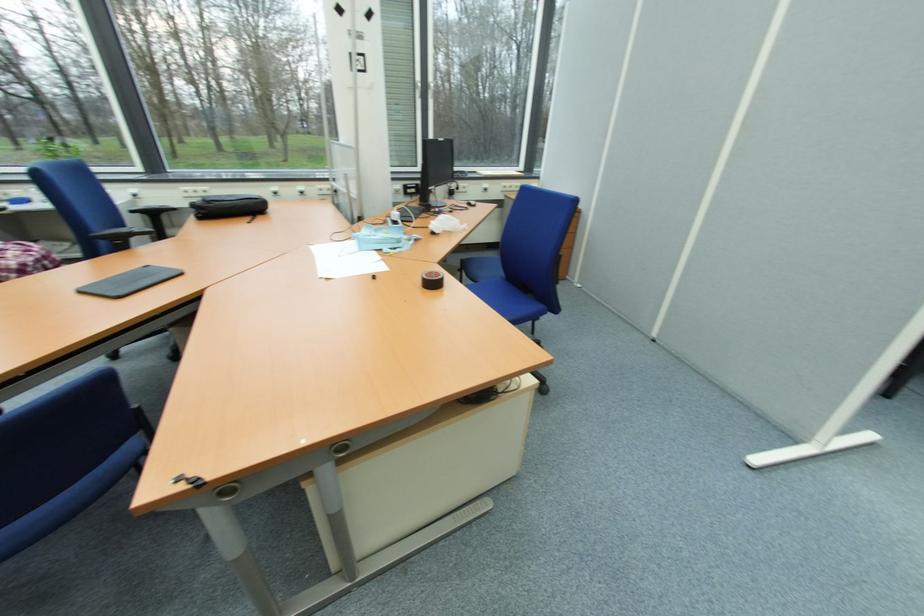
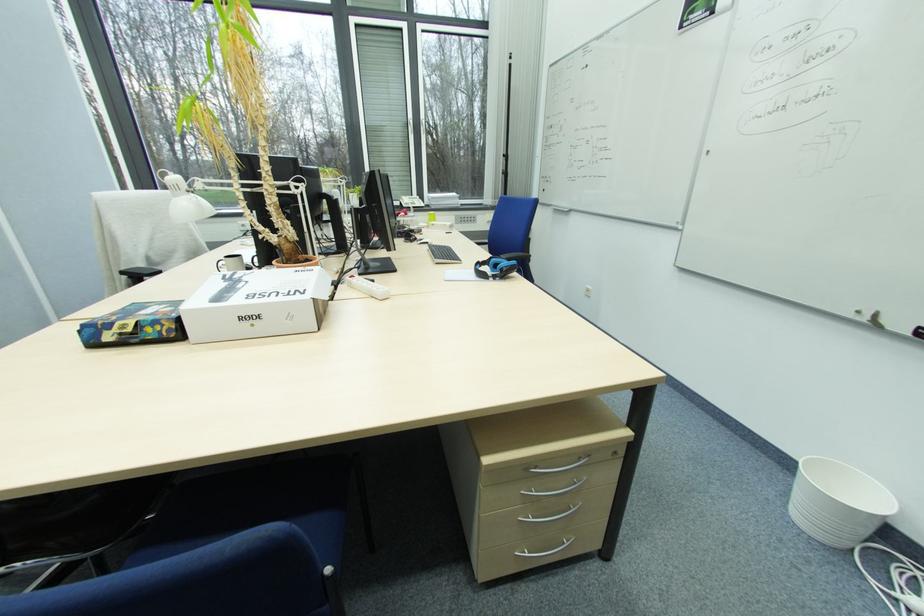
Question: What movement of the cameraman would produce the second image?

Choices:
 (A) Left
 (B) Right
 (C) Forward
 (D) Backward

Answer: (B)